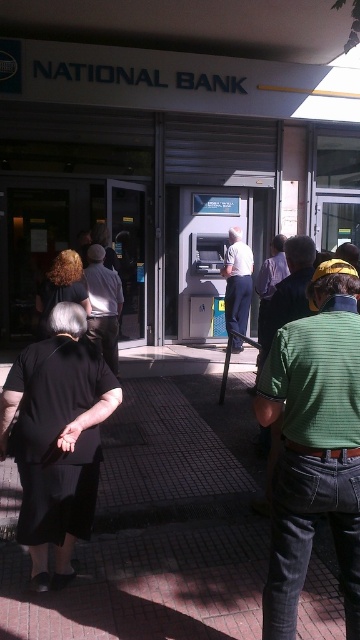
Is metal atm at center below green striped shirt at center?

No.

Does metal atm at center have a greater width compared to green striped shirt at center?

Indeed, metal atm at center has a greater width compared to green striped shirt at center.

What do you see at coordinates (172, 145) in the screenshot? This screenshot has width=360, height=640. I see `metal atm at center` at bounding box center [172, 145].

At what (x,y) coordinates should I click in order to perform the action: click on metal atm at center. Please return your answer as a coordinate pair (x, y). The image size is (360, 640). Looking at the image, I should click on (172, 145).

Can you confirm if metal atm at center is positioned below dark gray pants at center?

No, metal atm at center is not below dark gray pants at center.

Who is taller, metal atm at center or dark gray pants at center?

metal atm at center is taller.

Between point (181, 289) and point (119, 291), which one is positioned in front?

Point (119, 291) is in front.

Locate an element on the screen. metal atm at center is located at coordinates (172, 145).

Does metal atm at center appear on the right side of brick pavement at center?

Yes, metal atm at center is to the right of brick pavement at center.

Does metal atm at center have a greater height compared to brick pavement at center?

Correct, metal atm at center is much taller as brick pavement at center.

Identify the location of metal atm at center. (172, 145).

This screenshot has width=360, height=640. I want to click on metal atm at center, so click(172, 145).